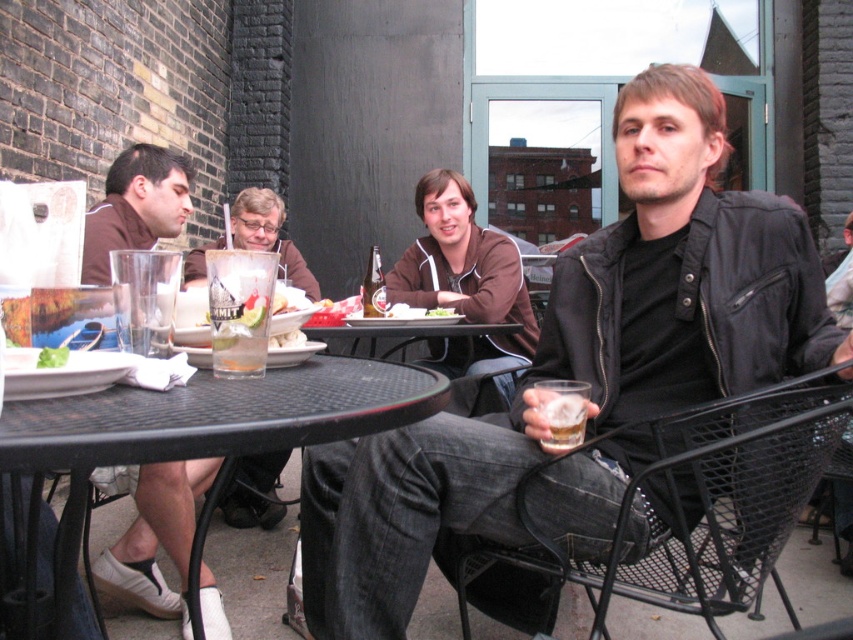
What object is located at the coordinates point (270, 236)?

The clear glass at center is located at point (270, 236).

You are a waiter at the restaurant and need to place a new drink order for the customer. The new drink is 24 inches wide. Can you fit it between the clear glass at center and the clear glass beer at center without moving any existing items?

The distance between the clear glass at center and the clear glass beer at center is 25.91 inches. Since the new drink is 24 inches wide, it can fit in the space between them.

You are standing in the restaurant patio and want to place a 22 inch wide plate on the black mesh table at lower left. Can the plate fit on the table?

The black mesh table at lower left and viewer are 24.00 inches apart, but the description does not specify the table width. Therefore, it is impossible to determine if the plate will fit.